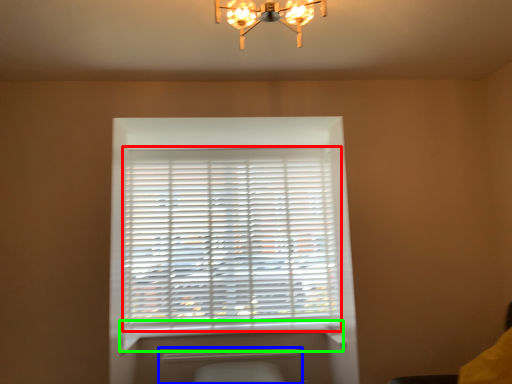
Question: Considering the real-world distances, which object is farthest from window blind (highlighted by a red box)? radiator (highlighted by a blue box) or window sill (highlighted by a green box)?

Choices:
 (A) radiator
 (B) window sill

Answer: (A)